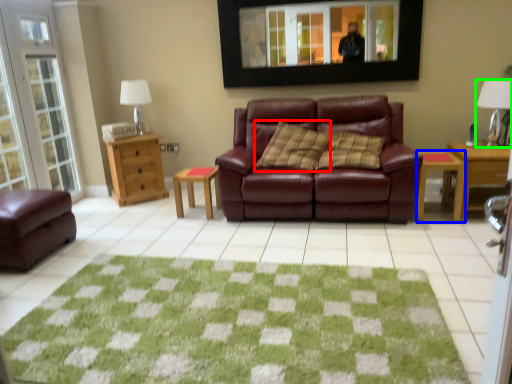
Question: Estimate the real-world distances between objects in this image. Which object is farther from pillow (highlighted by a red box), table (highlighted by a blue box) or lamp (highlighted by a green box)?

Choices:
 (A) table
 (B) lamp

Answer: (B)